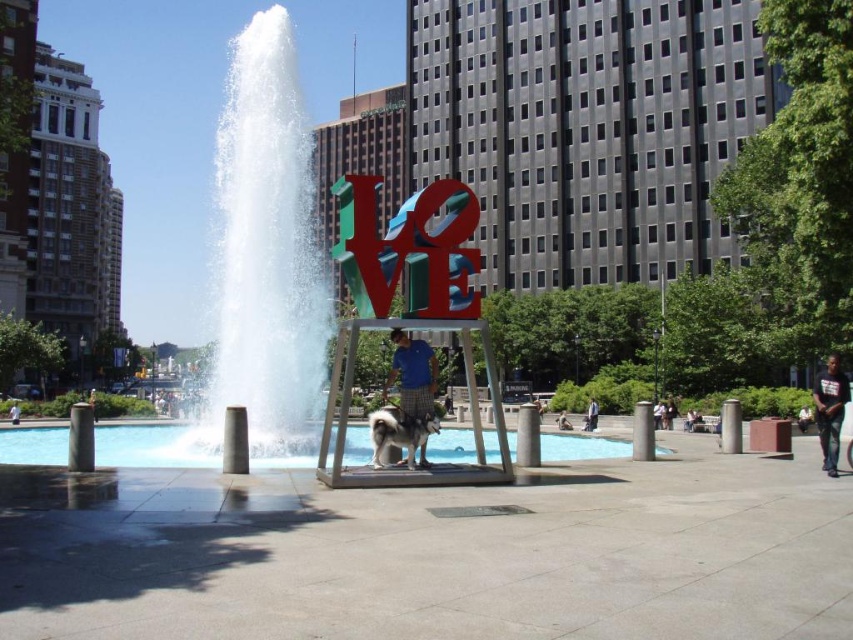
Question: Can you confirm if black cotton shirt at lower right is smaller than white cotton shirt at center?

Choices:
 (A) yes
 (B) no

Answer: (B)

Question: Which of these objects is positioned closest to the white fluffy dog at center?

Choices:
 (A) matte blue shirt at center
 (B) black cotton shirt at lower right
 (C) blue cotton shirt at center

Answer: (C)

Question: Which of the following is the farthest from the observer?

Choices:
 (A) (831, 376)
 (B) (93, 412)
 (C) (408, 461)
 (D) (558, 428)

Answer: (D)

Question: Among these points, which one is nearest to the camera?

Choices:
 (A) (556, 420)
 (B) (378, 445)
 (C) (9, 417)
 (D) (90, 396)

Answer: (B)

Question: Does white fluffy dog at center have a lesser width compared to dark blue shirt at center?

Choices:
 (A) no
 (B) yes

Answer: (A)

Question: Does blue cotton shirt at center have a larger size compared to black cotton shirt at lower right?

Choices:
 (A) no
 (B) yes

Answer: (A)